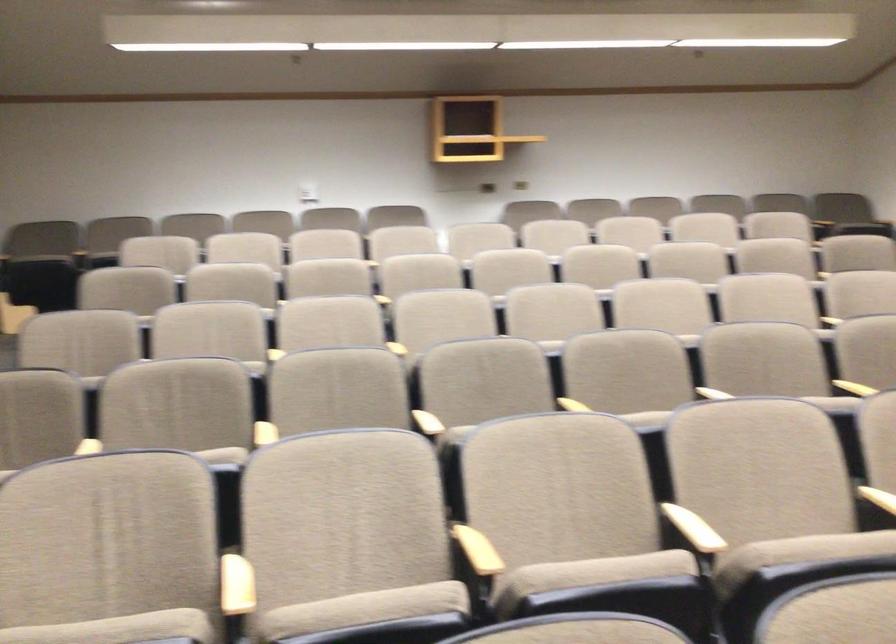
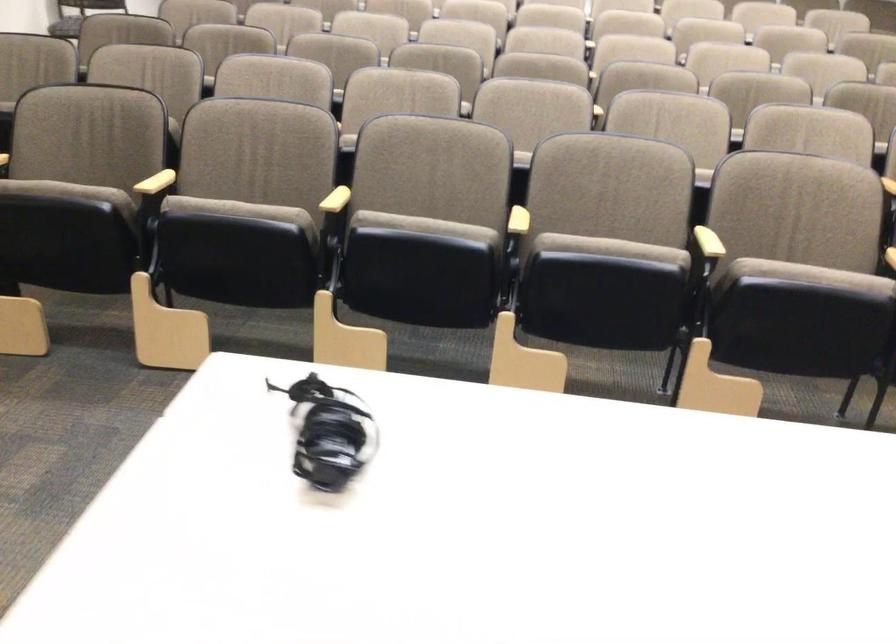
Question: I am providing you with two images of the same scene from different viewpoints. Please identify which objects are invisible in image2.

Choices:
 (A) wooden chair armrest
 (B) chair sitting surface
 (C) coffee maker handle
 (D) beige chair sitting surface

Answer: (D)